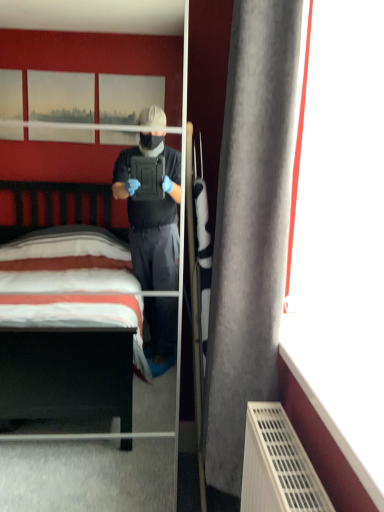
This screenshot has height=512, width=384. What do you see at coordinates (101, 464) in the screenshot?
I see `clear glass mirror at center` at bounding box center [101, 464].

Identify the location of clear glass mirror at center. The image size is (384, 512). (101, 464).

What is the approximate height of gray fabric curtain at right?

gray fabric curtain at right is 5.10 feet tall.

Describe the element at coordinates (251, 226) in the screenshot. This screenshot has width=384, height=512. I see `gray fabric curtain at right` at that location.

Locate an element on the screen. gray fabric curtain at right is located at coordinates (251, 226).

Find the location of a particular element. clear glass mirror at center is located at coordinates (101, 464).

In the scene shown: Between clear glass mirror at center and gray fabric curtain at right, which one appears on the left side from the viewer's perspective?

Positioned to the left is clear glass mirror at center.

Considering the relative positions of clear glass mirror at center and gray fabric curtain at right in the image provided, is clear glass mirror at center in front of gray fabric curtain at right?

No, it is not.

Which point is more forward, [20,430] or [269,97]?

The point [269,97] is more forward.

From the image's perspective, is clear glass mirror at center below gray fabric curtain at right?

Yes, from the image's perspective, clear glass mirror at center is below gray fabric curtain at right.

From a real-world perspective, is clear glass mirror at center located beneath gray fabric curtain at right?

Correct, in the physical world, clear glass mirror at center is lower than gray fabric curtain at right.

Which of these two, clear glass mirror at center or gray fabric curtain at right, is wider?

Wider between the two is clear glass mirror at center.

Which of these two, clear glass mirror at center or gray fabric curtain at right, stands taller?

Standing taller between the two is clear glass mirror at center.

Does clear glass mirror at center have a smaller size compared to gray fabric curtain at right?

Incorrect, clear glass mirror at center is not smaller in size than gray fabric curtain at right.

Is clear glass mirror at center inside the boundaries of gray fabric curtain at right, or outside?

The correct answer is: outside.

Is clear glass mirror at center next to gray fabric curtain at right?

There is a gap between clear glass mirror at center and gray fabric curtain at right.

Is clear glass mirror at center facing towards gray fabric curtain at right?

No.

How many degrees apart are the facing directions of clear glass mirror at center and gray fabric curtain at right?

There is a 88.7-degree angle between the facing directions of clear glass mirror at center and gray fabric curtain at right.

Locate an element on the screen. This screenshot has height=512, width=384. mirror that is below the gray fabric curtain at right (from the image's perspective) is located at coordinates (101, 464).

Is gray fabric curtain at right to the left or to the right of clear glass mirror at center in the image?

Clearly, gray fabric curtain at right is on the right of clear glass mirror at center in the image.

In the image, is gray fabric curtain at right positioned in front of or behind clear glass mirror at center?

Clearly, gray fabric curtain at right is in front of clear glass mirror at center.

Is point (285, 151) less distant than point (109, 174)?

Yes, point (285, 151) is closer to viewer.

From the image's perspective, between gray fabric curtain at right and clear glass mirror at center, who is located below?

clear glass mirror at center is shown below in the image.

From a real-world perspective, between gray fabric curtain at right and clear glass mirror at center, who is vertically higher?

From a 3D spatial view, gray fabric curtain at right is above.

From the picture: Considering the sizes of objects gray fabric curtain at right and clear glass mirror at center in the image provided, who is wider, gray fabric curtain at right or clear glass mirror at center?

With larger width is clear glass mirror at center.

Between gray fabric curtain at right and clear glass mirror at center, which one has more height?

Result: clear glass mirror at center.

Is gray fabric curtain at right bigger or smaller than clear glass mirror at center?

Clearly, gray fabric curtain at right is smaller in size than clear glass mirror at center.

Which is correct: gray fabric curtain at right is inside clear glass mirror at center, or outside of it?

gray fabric curtain at right is located beyond the bounds of clear glass mirror at center.

Is gray fabric curtain at right not near clear glass mirror at center?

Indeed, gray fabric curtain at right is not near clear glass mirror at center.

Is clear glass mirror at center at the back of gray fabric curtain at right?

That's not correct — gray fabric curtain at right is not looking away from clear glass mirror at center.

The height and width of the screenshot is (512, 384). Find the location of `curtain located in front of the clear glass mirror at center`. curtain located in front of the clear glass mirror at center is located at coordinates (251, 226).

This screenshot has width=384, height=512. In order to click on mirror behind the gray fabric curtain at right in this screenshot , I will do `click(101, 464)`.

I want to click on mirror below the gray fabric curtain at right (from the image's perspective), so click(101, 464).